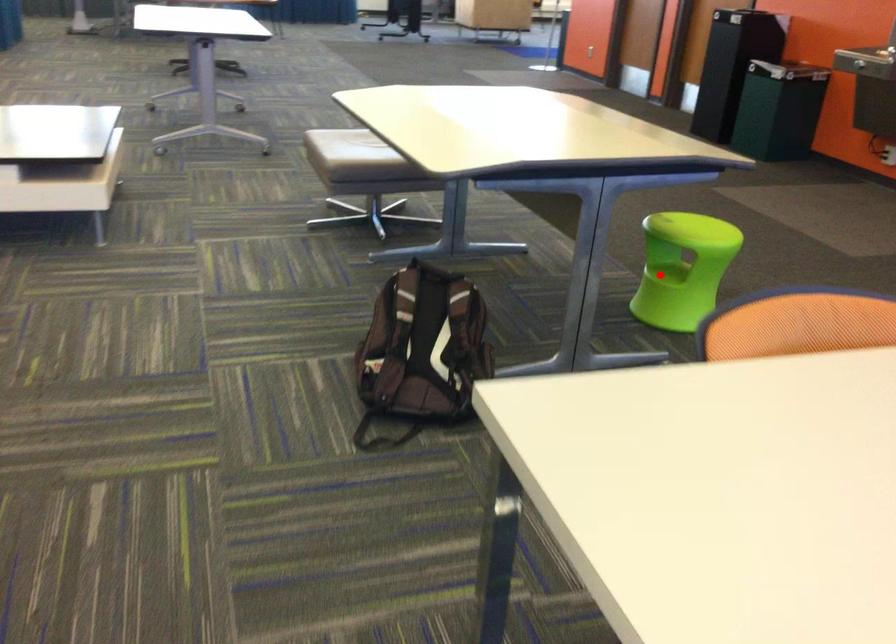
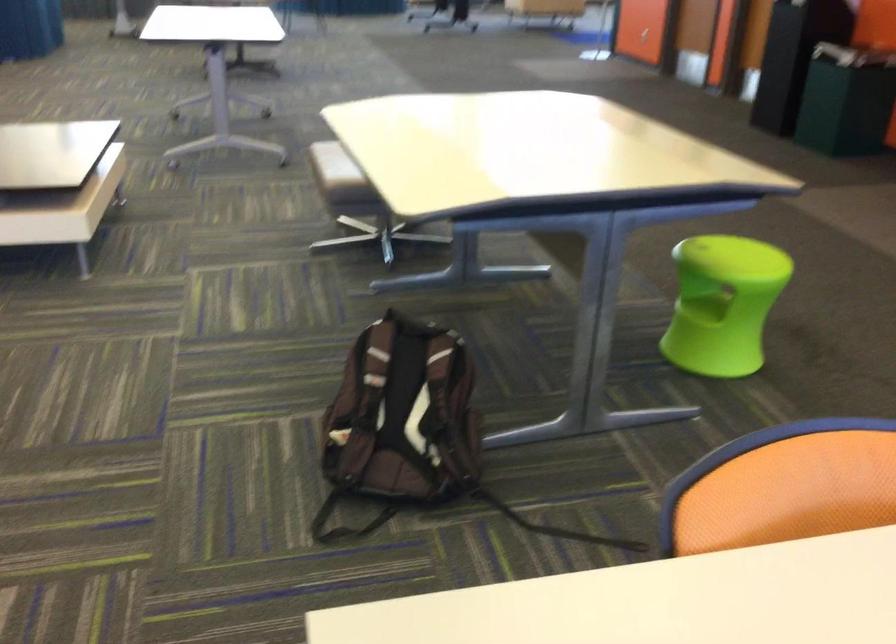
Question: I am providing you with two images of the same scene from different viewpoints. Image1 has a red point marked. In image2, the corresponding 3D location appears at what relative position? Reply with the corresponding letter.

Choices:
 (A) Closer
 (B) Farther

Answer: (A)